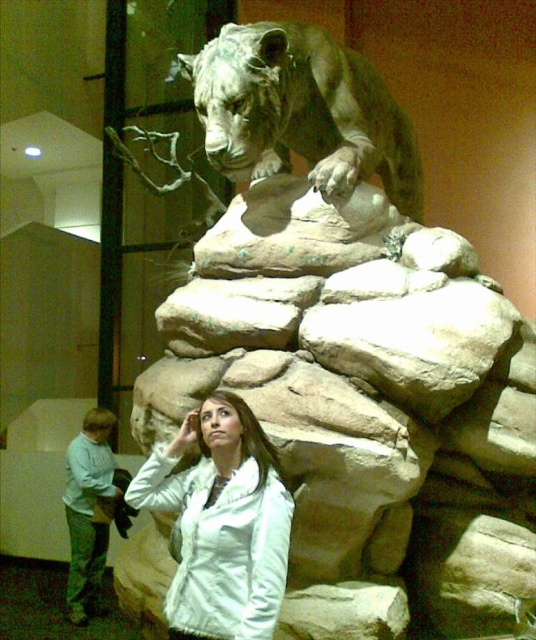
Question: Can you confirm if bronze statue of a lion at upper center is positioned to the right of white matte jacket at center?

Choices:
 (A) no
 (B) yes

Answer: (B)

Question: Can you confirm if bronze statue of a lion at upper center is positioned to the right of white matte jacket at center?

Choices:
 (A) no
 (B) yes

Answer: (B)

Question: Is bronze statue of a lion at upper center positioned before white matte jacket at center?

Choices:
 (A) yes
 (B) no

Answer: (B)

Question: Which of the following is the closest to the observer?

Choices:
 (A) (212, 54)
 (B) (273, 458)

Answer: (B)